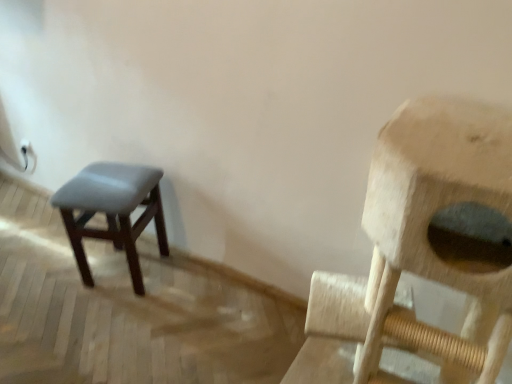
Image resolution: width=512 pixels, height=384 pixels. I want to click on vacant space underneath matte gray stool at left (from a real-world perspective), so click(128, 271).